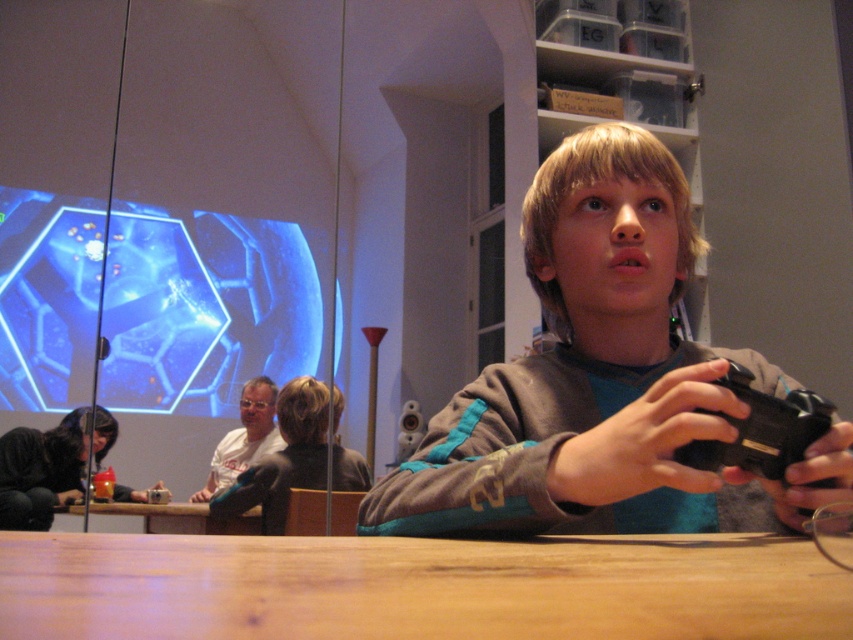
Question: Is the position of wooden table at lower center more distant than that of brown wooden table at lower center?

Choices:
 (A) no
 (B) yes

Answer: (A)

Question: Which object is the closest to the brown wooden table at lower center?

Choices:
 (A) matte gray hoodie at center
 (B) wooden table at lower center

Answer: (A)

Question: Observing the image, what is the correct spatial positioning of matte gray hoodie at center in reference to wooden table at lower center?

Choices:
 (A) above
 (B) below

Answer: (A)

Question: Considering the real-world distances, which object is closest to the brown wooden table at lower center?

Choices:
 (A) black matte camera at lower right
 (B) matte gray hoodie at center
 (C) wooden table at lower center

Answer: (B)

Question: Which point is closer to the camera taking this photo?

Choices:
 (A) (132, 509)
 (B) (654, 580)

Answer: (B)

Question: From the image, what is the correct spatial relationship of black matte camera at lower right in relation to brown wooden table at lower center?

Choices:
 (A) left
 (B) right

Answer: (B)